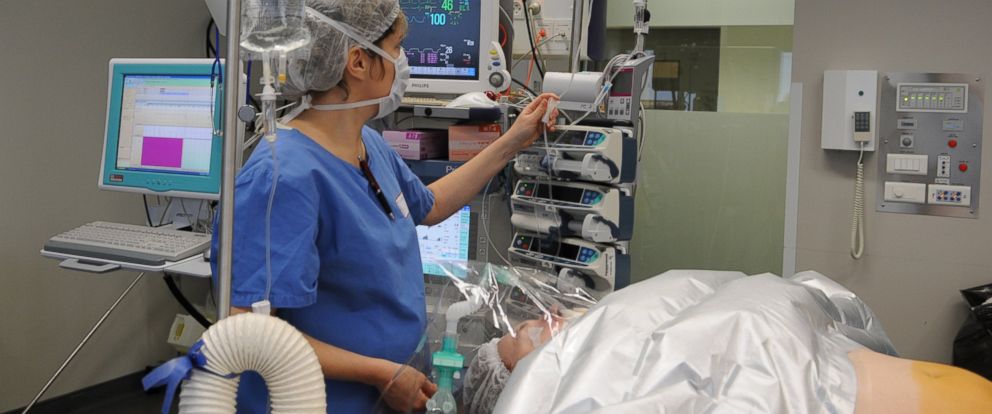
Find the location of `monitor`. monitor is located at coordinates (166, 118).